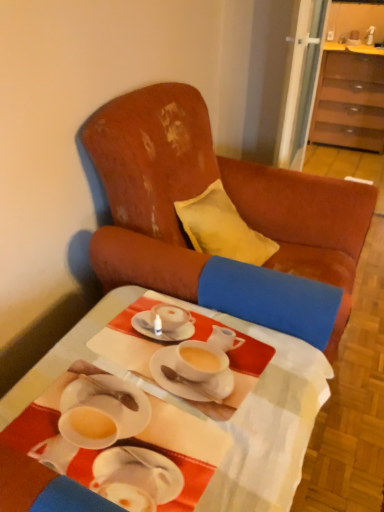
Question: From a real-world perspective, is distressed leather armchair at center under white glossy table at center?

Choices:
 (A) no
 (B) yes

Answer: (A)

Question: Can you confirm if distressed leather armchair at center is thinner than white glossy table at center?

Choices:
 (A) yes
 (B) no

Answer: (B)

Question: Is distressed leather armchair at center facing away from white glossy table at center?

Choices:
 (A) no
 (B) yes

Answer: (A)

Question: Considering the relative positions of distressed leather armchair at center and white glossy table at center in the image provided, is distressed leather armchair at center in front of white glossy table at center?

Choices:
 (A) no
 (B) yes

Answer: (A)

Question: Is distressed leather armchair at center further to camera compared to white glossy table at center?

Choices:
 (A) yes
 (B) no

Answer: (A)

Question: Considering the relative sizes of distressed leather armchair at center and white glossy table at center in the image provided, is distressed leather armchair at center wider than white glossy table at center?

Choices:
 (A) no
 (B) yes

Answer: (B)

Question: Considering the relative positions of brown wood cabinet at upper right and distressed leather armchair at center in the image provided, is brown wood cabinet at upper right to the left of distressed leather armchair at center from the viewer's perspective?

Choices:
 (A) no
 (B) yes

Answer: (A)

Question: Is brown wood cabinet at upper right behind distressed leather armchair at center?

Choices:
 (A) no
 (B) yes

Answer: (B)

Question: Is brown wood cabinet at upper right outside distressed leather armchair at center?

Choices:
 (A) no
 (B) yes

Answer: (B)

Question: Does brown wood cabinet at upper right have a smaller size compared to distressed leather armchair at center?

Choices:
 (A) yes
 (B) no

Answer: (A)

Question: Can you confirm if brown wood cabinet at upper right is thinner than distressed leather armchair at center?

Choices:
 (A) yes
 (B) no

Answer: (A)

Question: Is brown wood cabinet at upper right directly adjacent to distressed leather armchair at center?

Choices:
 (A) no
 (B) yes

Answer: (A)

Question: Is there a large distance between white glossy table at center and distressed leather armchair at center?

Choices:
 (A) no
 (B) yes

Answer: (A)